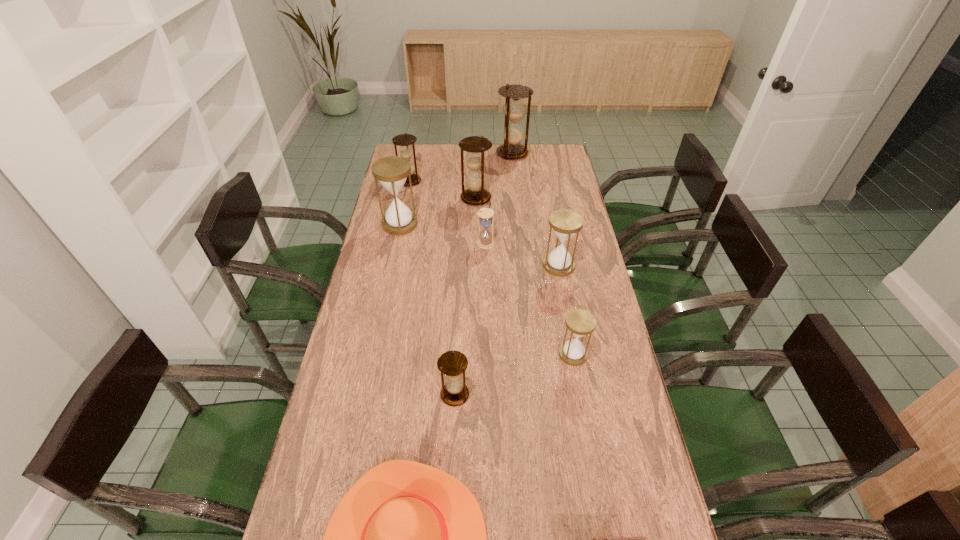
Identify the location of the second nearest hourglass. (580, 322).

I want to click on the nearest white hourglass, so click(x=580, y=322).

Identify the location of the nearest hourglass. (452, 364).

The image size is (960, 540). I want to click on the smallest brown hourglass, so pyautogui.click(x=452, y=364).

Where is `vacant area situated 0.360m on the front of the farthest object`? The image size is (960, 540). vacant area situated 0.360m on the front of the farthest object is located at coordinates click(x=517, y=206).

Find the location of a particular element. The width and height of the screenshot is (960, 540). vacant space located on the front of the second biggest brown hourglass is located at coordinates (475, 231).

Identify the location of free region located on the back of the biggest white hourglass. (411, 173).

At what (x,y) coordinates should I click in order to perform the action: click on vacant space positioned 0.150m on the right of the second farthest brown hourglass. Please return your answer as a coordinate pair (x, y). This screenshot has height=540, width=960. Looking at the image, I should click on (454, 181).

Identify the location of vacant space situated on the back of the sixth farthest hourglass. Image resolution: width=960 pixels, height=540 pixels. (548, 211).

Locate an element on the screen. vacant area situated on the back of the third white hourglass from right to left is located at coordinates click(x=485, y=196).